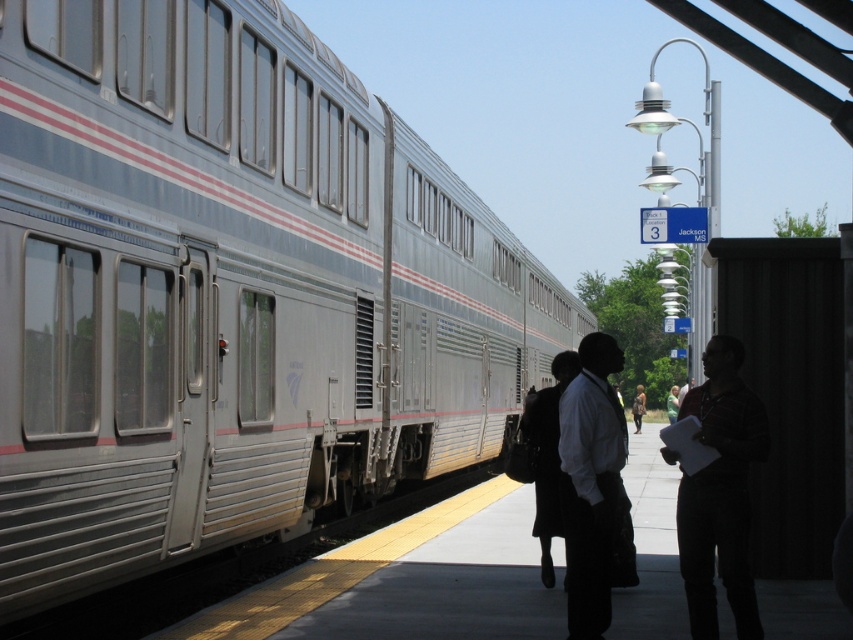
Question: From the image, what is the correct spatial relationship of silver metallic train at left in relation to black fabric shirt at right?

Choices:
 (A) left
 (B) right

Answer: (B)

Question: Among these objects, which one is farthest from the camera?

Choices:
 (A) black fabric shirt at right
 (B) dark fabric dress at center

Answer: (B)

Question: Does silver metallic train at left have a greater width compared to dark gray suit at right?

Choices:
 (A) yes
 (B) no

Answer: (A)

Question: Which object appears farthest from the camera in this image?

Choices:
 (A) dark gray suit at right
 (B) black fabric shirt at right

Answer: (A)

Question: Does dark gray suit at right appear under dark fabric dress at center?

Choices:
 (A) yes
 (B) no

Answer: (B)

Question: Which is farther from the dark gray suit at right?

Choices:
 (A) dark fabric dress at center
 (B) silver metallic train at left
 (C) black fabric shirt at right

Answer: (B)